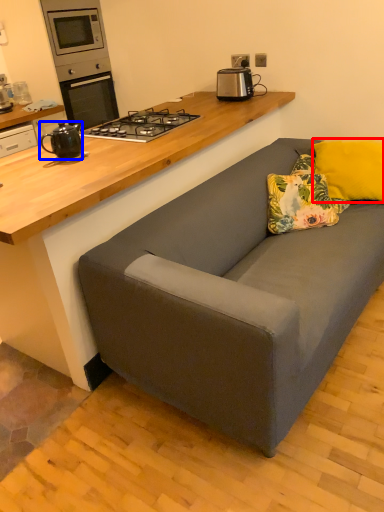
Question: Which point is closer to the camera, pillow (highlighted by a red box) or kitchen appliance (highlighted by a blue box)?

Choices:
 (A) pillow
 (B) kitchen appliance

Answer: (B)